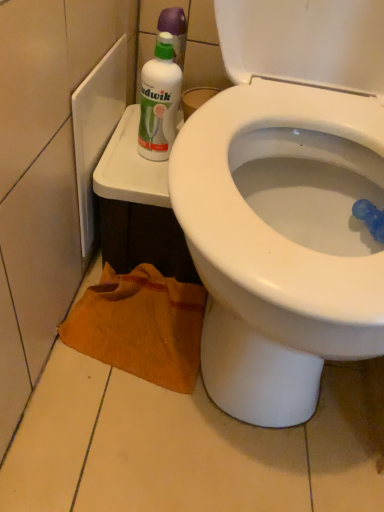
Question: From the image's perspective, is white plastic bottle at upper left above or below brown fabric towel at lower left?

Choices:
 (A) below
 (B) above

Answer: (B)

Question: Would you say white plastic bottle at upper left is to the left or to the right of brown fabric towel at lower left in the picture?

Choices:
 (A) right
 (B) left

Answer: (A)

Question: Based on their relative distances, which object is farther from the white plastic bottle at upper left?

Choices:
 (A) brown fabric towel at lower left
 (B) white glossy bidet at upper right

Answer: (A)

Question: Which is nearer to the white plastic bottle at upper left?

Choices:
 (A) white glossy bidet at upper right
 (B) brown fabric towel at lower left

Answer: (A)